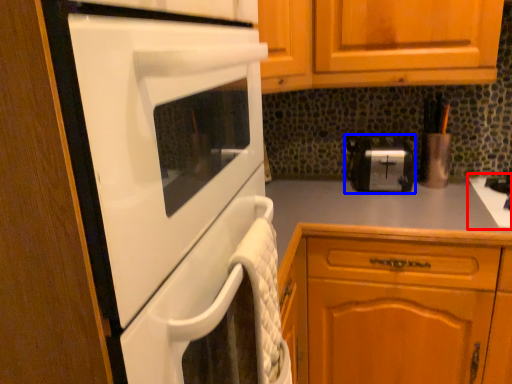
Question: Which of the following is the farthest to the observer, gas stove (highlighted by a red box) or toaster (highlighted by a blue box)?

Choices:
 (A) gas stove
 (B) toaster

Answer: (B)